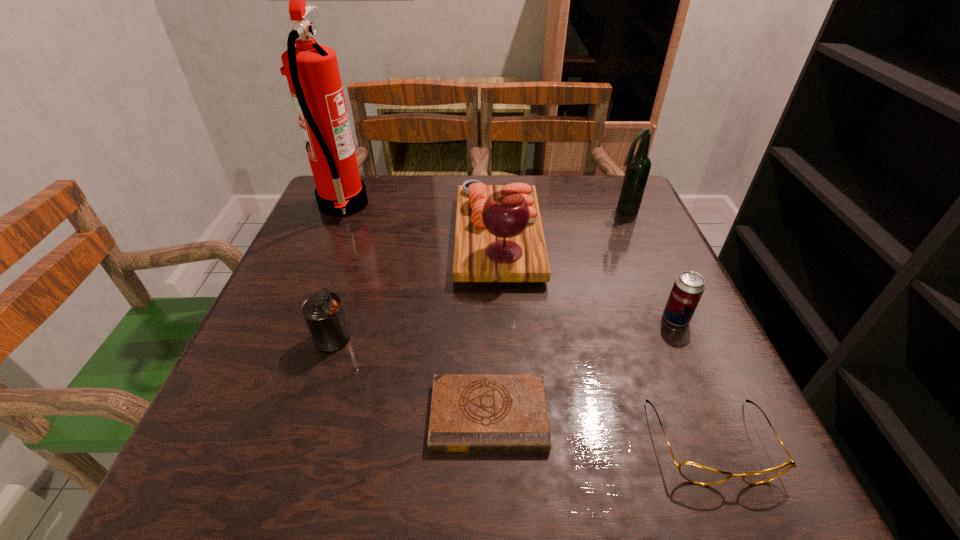
This screenshot has width=960, height=540. I want to click on vacant space situated on the right of the can, so click(514, 339).

I want to click on vacant space positioned on the back of the beer can, so click(x=625, y=204).

Locate an element on the screen. The image size is (960, 540). vacant space located 0.060m on the spine side of the shortest object is located at coordinates (490, 495).

Locate an element on the screen. fire extinguisher at the far edge is located at coordinates (312, 72).

Identify the location of beer bottle at the far edge. (638, 167).

You are a GUI agent. You are given a task and a screenshot of the screen. Output one action in this format:
    pyautogui.click(x=<x>, y=<y>)
    Task: Click on the platter at the far edge
    This screenshot has width=960, height=540.
    Given the screenshot: What is the action you would take?
    pyautogui.click(x=498, y=237)

Locate an element on the screen. spectacles located at the near edge is located at coordinates (693, 472).

Find the location of `diary located in the near edge section of the desktop`. diary located in the near edge section of the desktop is located at coordinates (469, 412).

Where is `fire extinguisher situated at the left edge`? fire extinguisher situated at the left edge is located at coordinates (312, 72).

Find the location of a particular element. Image resolution: width=960 pixels, height=540 pixels. can that is at the left edge is located at coordinates (323, 312).